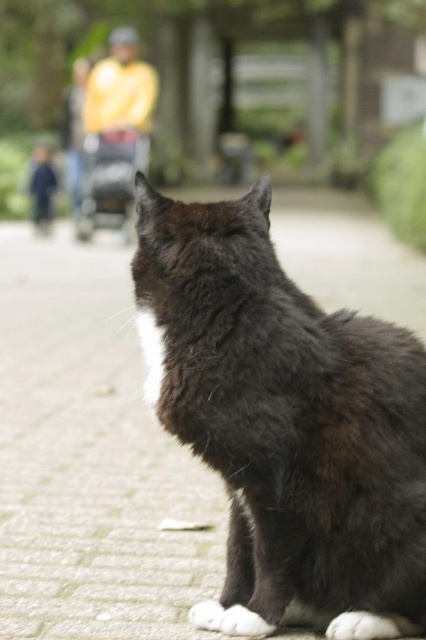
Looking at this image, you are standing in a garden and see the black fur cat at center. If you want to pet the cat without approaching closer than 6 feet, is it possible?

Answer: The black fur cat at center is 5.55 feet from viewer, so you are already closer than 6 feet. You need to move back to maintain the 6 feet distance.

You are a photographer trying to capture the black fur cat at center. The camera you are using has a focus point at coordinates 0.662, 0.671. Will the cat be in focus?

Yes, the black fur cat at center is exactly at the focus point coordinates (285, 422), so it will be in focus.